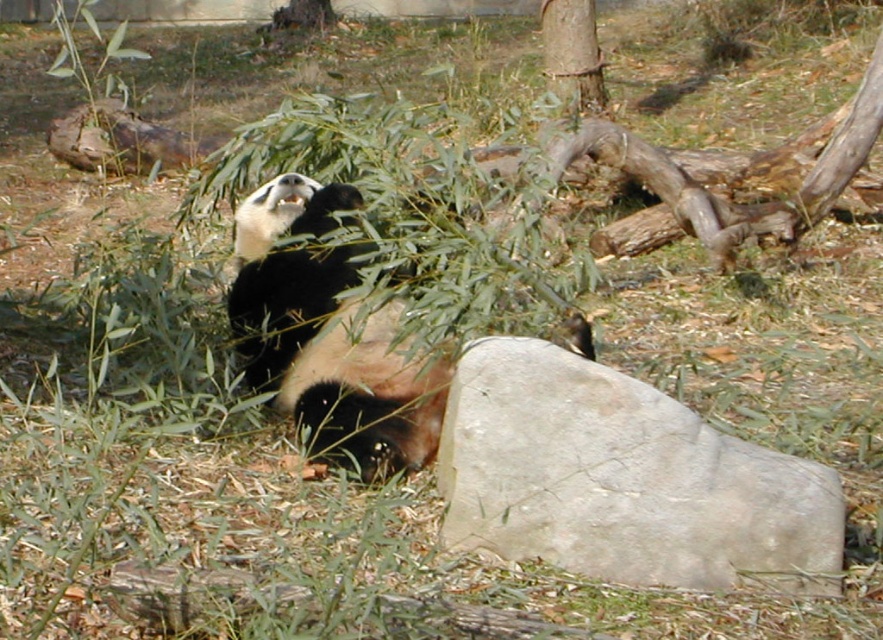
Question: Observing the image, what is the correct spatial positioning of black fur panda at center in reference to smooth brown tree trunk at upper center?

Choices:
 (A) above
 (B) below

Answer: (B)

Question: Based on their relative distances, which object is farther from the gray rock at center?

Choices:
 (A) smooth brown tree trunk at upper center
 (B) black fur panda at center

Answer: (A)

Question: Estimate the real-world distances between objects in this image. Which object is farther from the gray rock at center?

Choices:
 (A) black fur panda at center
 (B) smooth brown tree trunk at upper center

Answer: (B)

Question: Based on their relative distances, which object is nearer to the black fur panda at center?

Choices:
 (A) gray rock at center
 (B) smooth brown tree trunk at upper center

Answer: (A)

Question: Is gray rock at center smaller than smooth brown tree trunk at upper center?

Choices:
 (A) yes
 (B) no

Answer: (B)

Question: From the image, what is the correct spatial relationship of gray rock at center in relation to black fur panda at center?

Choices:
 (A) left
 (B) right

Answer: (B)